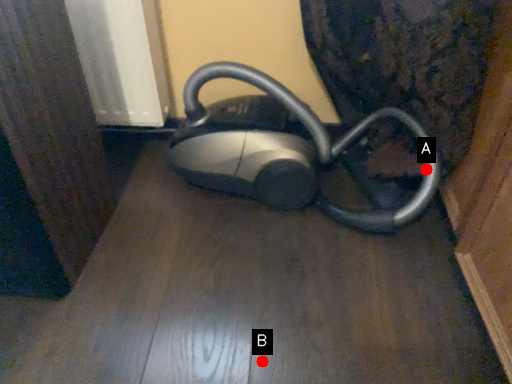
Question: Two points are circled on the image, labeled by A and B beside each circle. Which point is closer to the camera?

Choices:
 (A) A is closer
 (B) B is closer

Answer: (B)